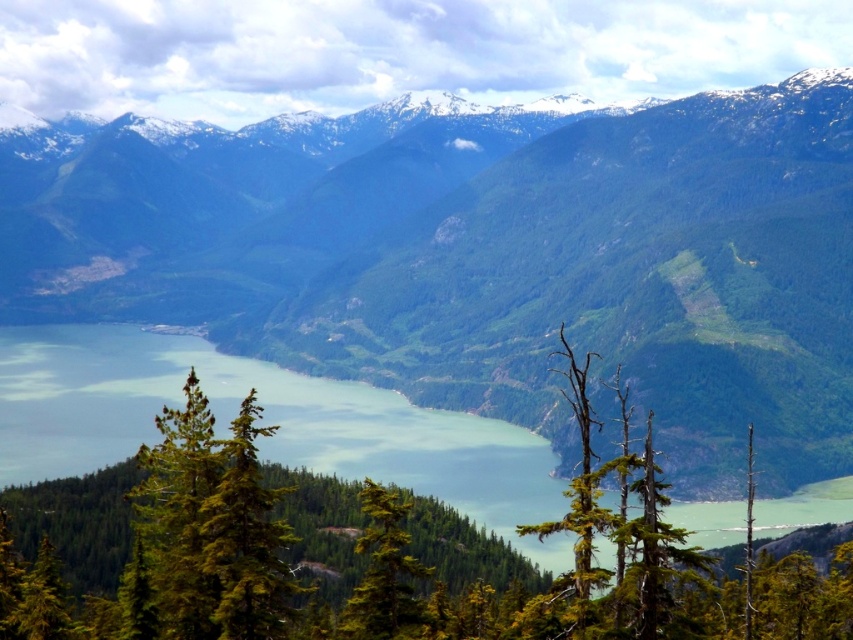
Which of these two, green water at center or green needle-like tree at center, stands shorter?

green needle-like tree at center

Which is behind, point (192, 337) or point (219, 490)?

The point (192, 337) is behind.

The image size is (853, 640). I want to click on green water at center, so click(x=264, y=420).

How distant is green forested mountain range at center from green matte tree at center?

green forested mountain range at center and green matte tree at center are 208.27 meters apart from each other.

Between green forested mountain range at center and green matte tree at center, which one has less height?

green matte tree at center

The height and width of the screenshot is (640, 853). I want to click on green forested mountain range at center, so click(x=563, y=273).

The image size is (853, 640). Describe the element at coordinates (264, 420) in the screenshot. I see `green water at center` at that location.

Between green water at center and green matte tree at center, which one is positioned higher?

Positioned higher is green water at center.

Which is behind, point (294, 396) or point (372, 520)?

Positioned behind is point (294, 396).

Where is `green water at center`? green water at center is located at coordinates (264, 420).